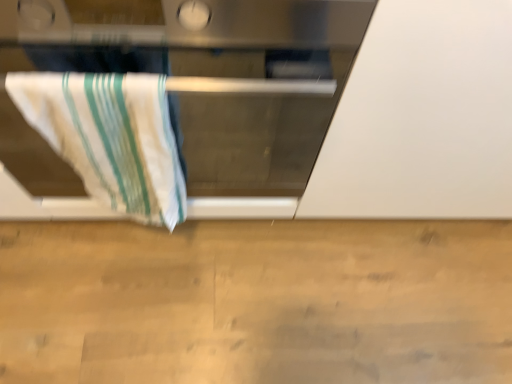
Question: Is white matte oven at upper left completely or partially inside white cotton towel at left?

Choices:
 (A) yes
 (B) no

Answer: (B)

Question: Is white cotton towel at left far from white matte oven at upper left?

Choices:
 (A) yes
 (B) no

Answer: (B)

Question: Considering the relative sizes of white cotton towel at left and white matte oven at upper left in the image provided, is white cotton towel at left thinner than white matte oven at upper left?

Choices:
 (A) yes
 (B) no

Answer: (A)

Question: Can you see white cotton towel at left touching white matte oven at upper left?

Choices:
 (A) yes
 (B) no

Answer: (B)

Question: Is white cotton towel at left at the right side of white matte oven at upper left?

Choices:
 (A) yes
 (B) no

Answer: (B)

Question: Is white cotton towel at left not inside white matte oven at upper left?

Choices:
 (A) no
 (B) yes

Answer: (A)

Question: Considering the relative sizes of white matte oven at upper left and white cotton towel at left in the image provided, is white matte oven at upper left shorter than white cotton towel at left?

Choices:
 (A) yes
 (B) no

Answer: (B)

Question: Is white matte oven at upper left touching white cotton towel at left?

Choices:
 (A) no
 (B) yes

Answer: (A)

Question: Is white matte oven at upper left closer to camera compared to white cotton towel at left?

Choices:
 (A) yes
 (B) no

Answer: (A)

Question: Is white matte oven at upper left behind white cotton towel at left?

Choices:
 (A) no
 (B) yes

Answer: (A)

Question: Is white matte oven at upper left thinner than white cotton towel at left?

Choices:
 (A) yes
 (B) no

Answer: (B)

Question: From a real-world perspective, is white matte oven at upper left physically below white cotton towel at left?

Choices:
 (A) yes
 (B) no

Answer: (B)

Question: In the image, is white matte oven at upper left on the left side or the right side of white cotton towel at left?

Choices:
 (A) left
 (B) right

Answer: (B)